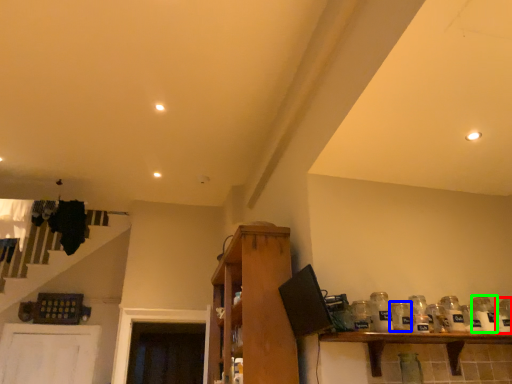
Question: Estimate the real-world distances between objects in this image. Which object is closer to glass jar (highlighted by a red box), glass jar (highlighted by a blue box) or glass bottle (highlighted by a green box)?

Choices:
 (A) glass jar
 (B) glass bottle

Answer: (B)